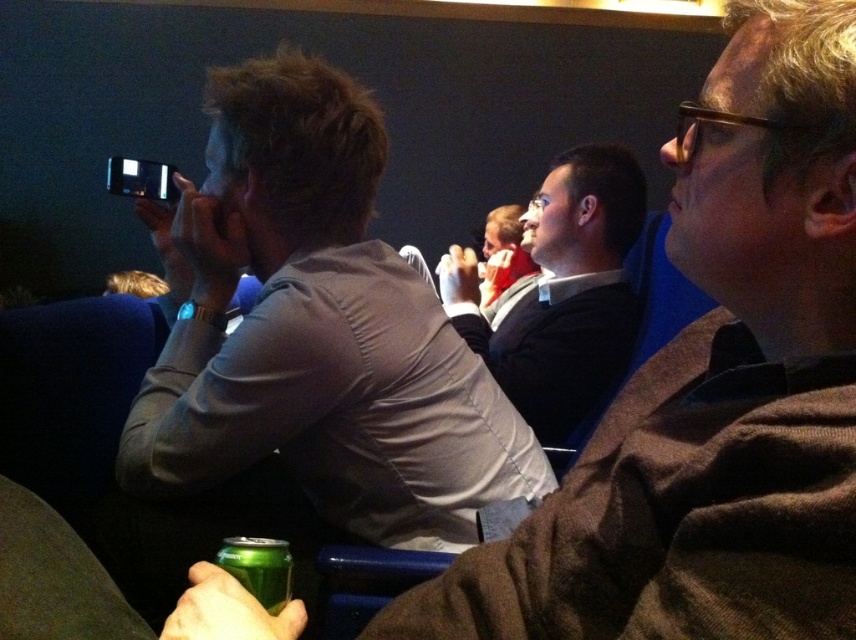
Does dark gray suit at center have a greater width compared to green metallic can at lower left?

Indeed, dark gray suit at center has a greater width compared to green metallic can at lower left.

Which is behind, point (456, 275) or point (259, 540)?

Positioned behind is point (456, 275).

Where is `dark gray suit at center`? dark gray suit at center is located at coordinates coord(562,292).

Can you confirm if matte gray shirt at center is bigger than dark gray suit at center?

No.

At what (x,y) coordinates should I click in order to perform the action: click on matte gray shirt at center. Please return your answer as a coordinate pair (x, y). This screenshot has width=856, height=640. Looking at the image, I should click on (314, 330).

Image resolution: width=856 pixels, height=640 pixels. What are the coordinates of `matte gray shirt at center` in the screenshot? It's located at (314, 330).

Is matte gray shirt at center bigger than green metallic can at lower left?

Yes, matte gray shirt at center is bigger than green metallic can at lower left.

How much distance is there between matte gray shirt at center and green metallic can at lower left?

A distance of 57.89 centimeters exists between matte gray shirt at center and green metallic can at lower left.

Locate an element on the screen. matte gray shirt at center is located at coordinates (314, 330).